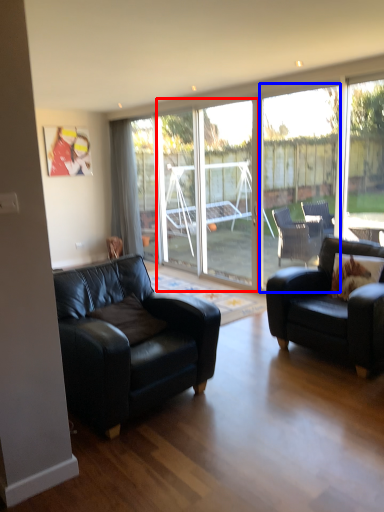
Question: Which point is further to the camera, screen door (highlighted by a red box) or window (highlighted by a blue box)?

Choices:
 (A) screen door
 (B) window

Answer: (A)